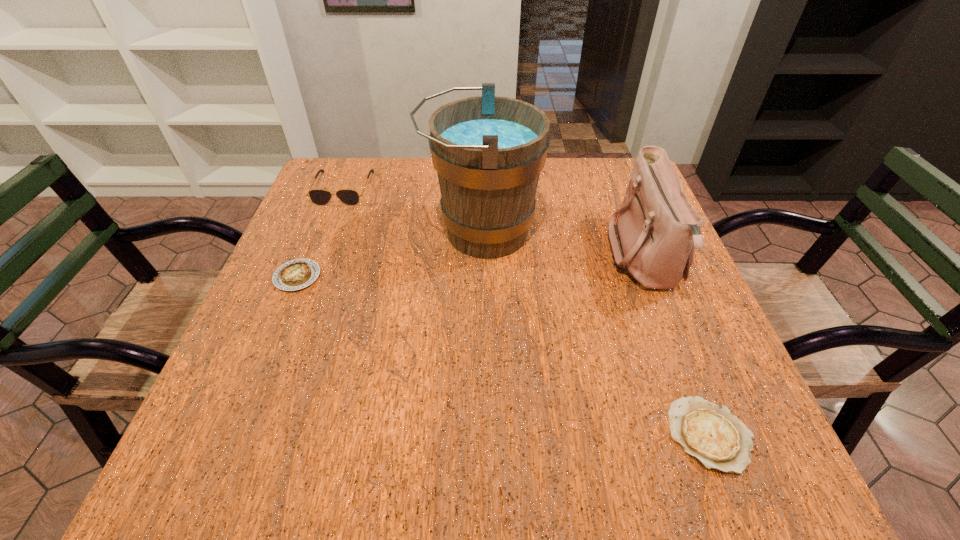
Locate an element on the screen. The image size is (960, 540). the tallest object is located at coordinates (488, 151).

This screenshot has width=960, height=540. Find the location of `wine bucket`. wine bucket is located at coordinates (488, 151).

At what (x,y) coordinates should I click in order to perform the action: click on the fourth shortest object. Please return your answer as a coordinate pair (x, y). Image resolution: width=960 pixels, height=540 pixels. Looking at the image, I should click on (657, 229).

Locate an element on the screen. Image resolution: width=960 pixels, height=540 pixels. the third shortest object is located at coordinates (320, 197).

Where is `the left quiche`? This screenshot has height=540, width=960. the left quiche is located at coordinates (299, 273).

Where is `the right quiche`? The width and height of the screenshot is (960, 540). the right quiche is located at coordinates (711, 433).

The height and width of the screenshot is (540, 960). I want to click on the nearest object, so click(711, 433).

The height and width of the screenshot is (540, 960). Identify the location of free space located with a handle on the side of the tallest object. (386, 232).

What are the coordinates of `vacant space located with a handle on the side of the tallest object` in the screenshot? It's located at (402, 232).

Locate an element on the screen. Image resolution: width=960 pixels, height=540 pixels. blank space located 0.170m with a handle on the side of the tallest object is located at coordinates (352, 232).